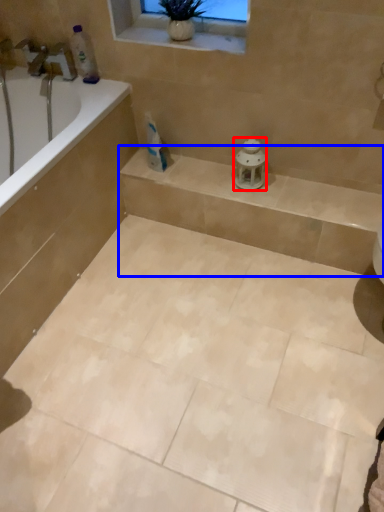
Question: Among these objects, which one is nearest to the camera, porcelain (highlighted by a red box) or balustrade (highlighted by a blue box)?

Choices:
 (A) porcelain
 (B) balustrade

Answer: (B)